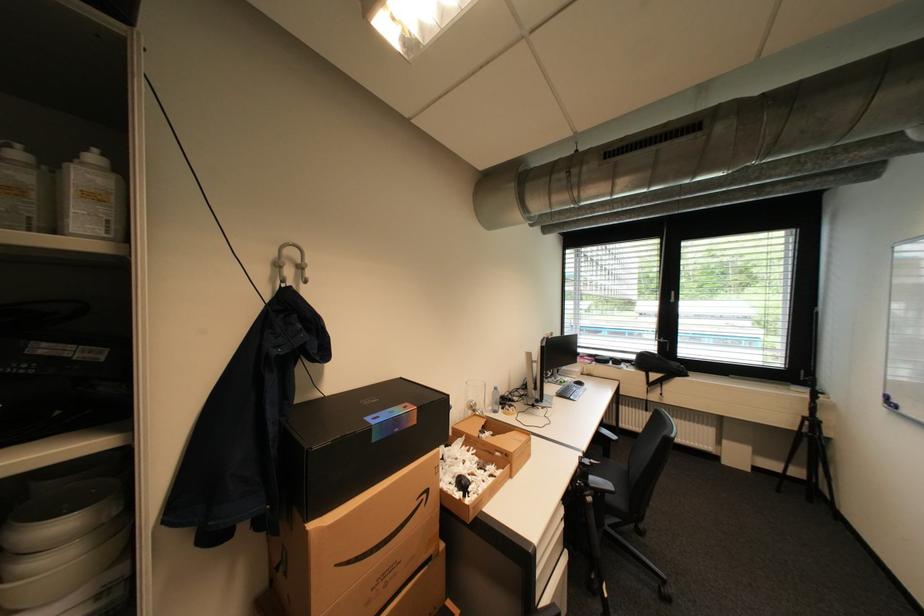
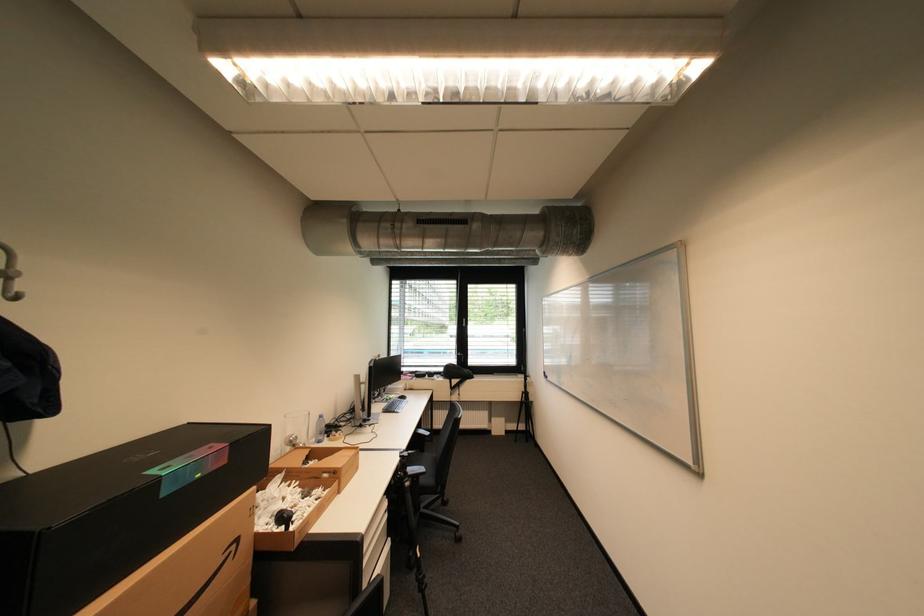
Question: The images are taken continuously from a first-person perspective. In which direction is your viewpoint rotating?

Choices:
 (A) Left
 (B) Right
 (C) Up
 (D) Down

Answer: (B)